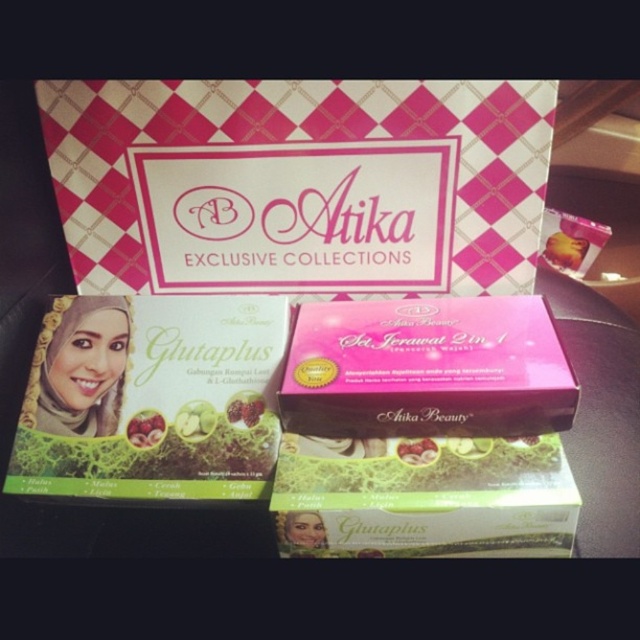
Can you confirm if green matte box at lower center is positioned below pink matte box at upper center?

Yes, green matte box at lower center is below pink matte box at upper center.

Can you confirm if green matte box at lower center is bigger than pink matte box at upper center?

Correct, green matte box at lower center is larger in size than pink matte box at upper center.

You are a GUI agent. You are given a task and a screenshot of the screen. Output one action in this format:
    pyautogui.click(x=<x>, y=<y>)
    Task: Click on the green matte box at lower center
    The width and height of the screenshot is (640, 640).
    Given the screenshot: What is the action you would take?
    click(422, 497)

Does pink matte box at center appear over pink matte box at upper center?

Incorrect, pink matte box at center is not positioned above pink matte box at upper center.

Does pink matte box at center come in front of pink matte box at upper center?

Yes, pink matte box at center is closer to the viewer.

The height and width of the screenshot is (640, 640). In order to click on pink matte box at center in this screenshot , I will do tap(426, 369).

Is point (321, 426) positioned behind point (300, 531)?

Yes, point (321, 426) is behind point (300, 531).

Which is more to the left, pink matte box at center or green matte box at lower center?

green matte box at lower center is more to the left.

Which is behind, point (412, 388) or point (316, 524)?

The point (412, 388) is more distant.

You are a GUI agent. You are given a task and a screenshot of the screen. Output one action in this format:
    pyautogui.click(x=<x>, y=<y>)
    Task: Click on the pink matte box at center
    The image size is (640, 640).
    Given the screenshot: What is the action you would take?
    pyautogui.click(x=426, y=369)